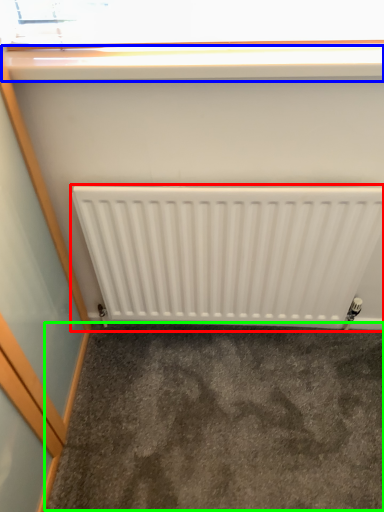
Question: Which object is positioned farthest from radiator (highlighted by a red box)? Select from window sill (highlighted by a blue box) and concrete (highlighted by a green box).

Choices:
 (A) window sill
 (B) concrete

Answer: (A)